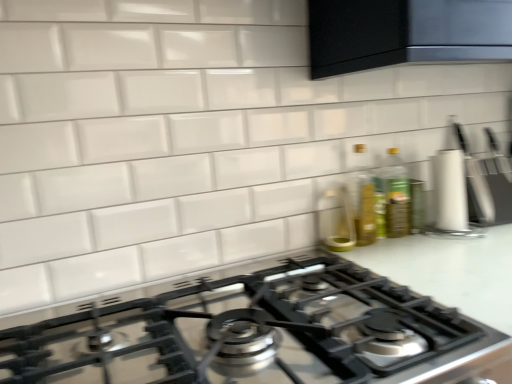
Where is `unoccupied area in front of translucent glass bottle at right, placed as the 2th bottle when sorted from right to left`? The height and width of the screenshot is (384, 512). unoccupied area in front of translucent glass bottle at right, placed as the 2th bottle when sorted from right to left is located at coordinates (395, 254).